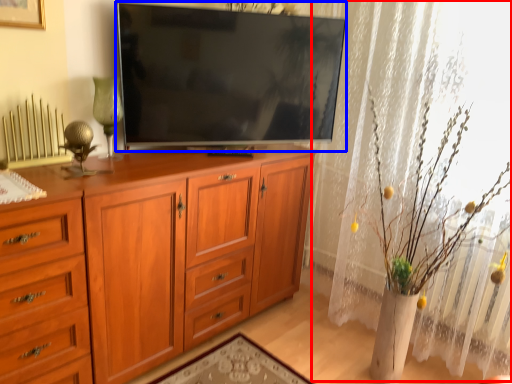
Question: Which object appears closest to the camera in this image, curtain (highlighted by a red box) or television (highlighted by a blue box)?

Choices:
 (A) curtain
 (B) television

Answer: (A)